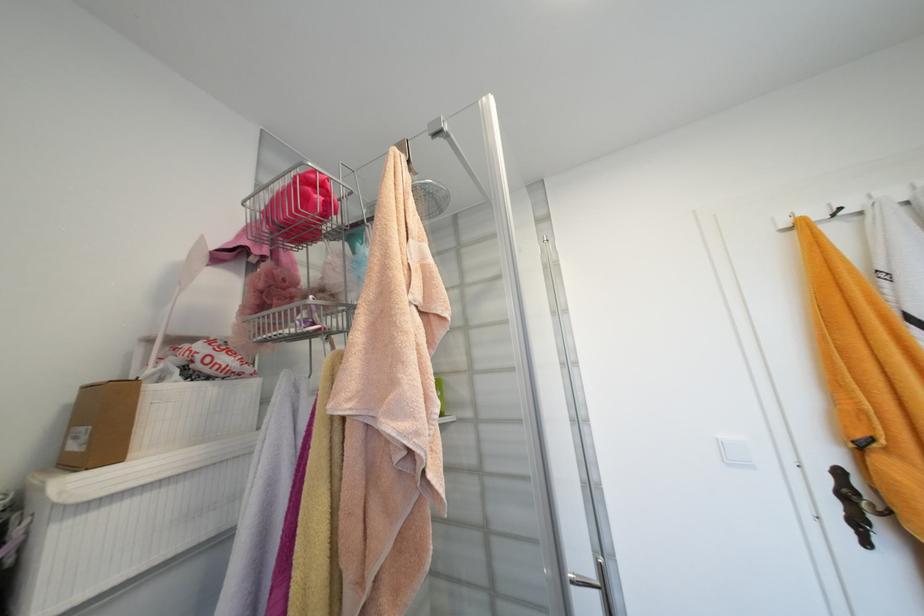
The height and width of the screenshot is (616, 924). What do you see at coordinates (430, 198) in the screenshot?
I see `a metal shower head` at bounding box center [430, 198].